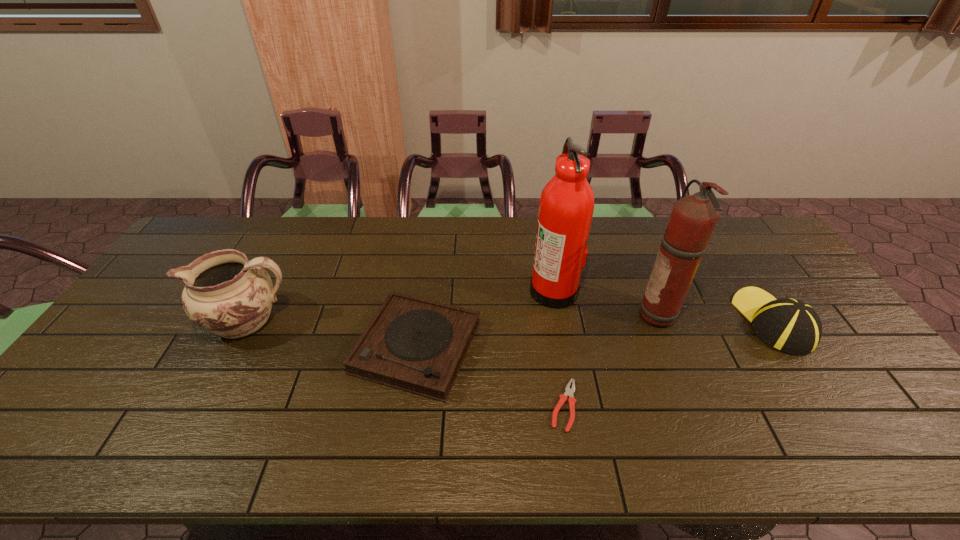
Find the location of a particular element. The image size is (960, 540). the left fire extinguisher is located at coordinates (566, 207).

Locate an element on the screen. the fifth object from left to right is located at coordinates (693, 218).

Identify the location of pitcher. (225, 294).

You are a GUI agent. You are given a task and a screenshot of the screen. Output one action in this format:
    pyautogui.click(x=<x>, y=<y>)
    Task: Click on the leftmost object
    
    Given the screenshot: What is the action you would take?
    pyautogui.click(x=225, y=294)

Locate an element on the screen. The width and height of the screenshot is (960, 540). the third shortest object is located at coordinates (789, 325).

Locate an element on the screen. baseball cap is located at coordinates (789, 325).

What are the coordinates of `the fifth tallest object` in the screenshot? It's located at (412, 344).

Where is `phonograph record`? This screenshot has width=960, height=540. phonograph record is located at coordinates (412, 344).

Identify the location of pliers. (568, 392).

This screenshot has height=540, width=960. Identify the location of vacant space located on the label side of the left fire extinguisher. (497, 289).